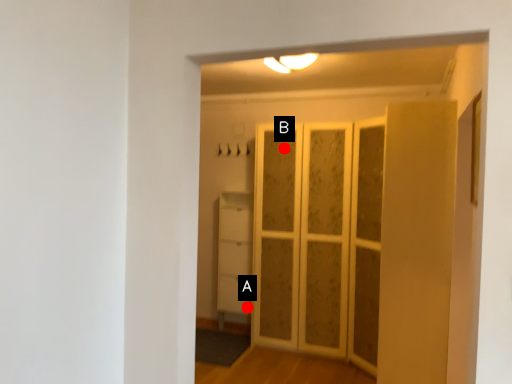
Question: Two points are circled on the image, labeled by A and B beside each circle. Which point is farther from the camera taking this photo?

Choices:
 (A) A is further
 (B) B is further

Answer: (A)